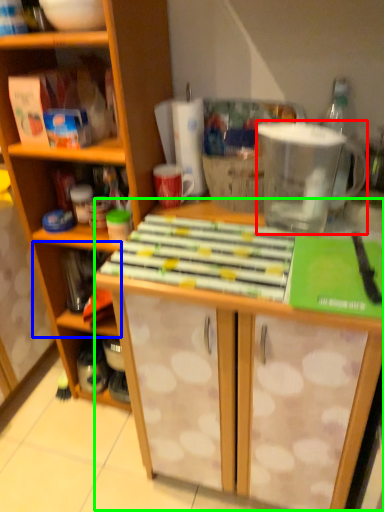
Question: Which object is the closest to the appliance (highlighted by a red box)? Choose among these: shelf (highlighted by a blue box) or table (highlighted by a green box).

Choices:
 (A) shelf
 (B) table

Answer: (B)